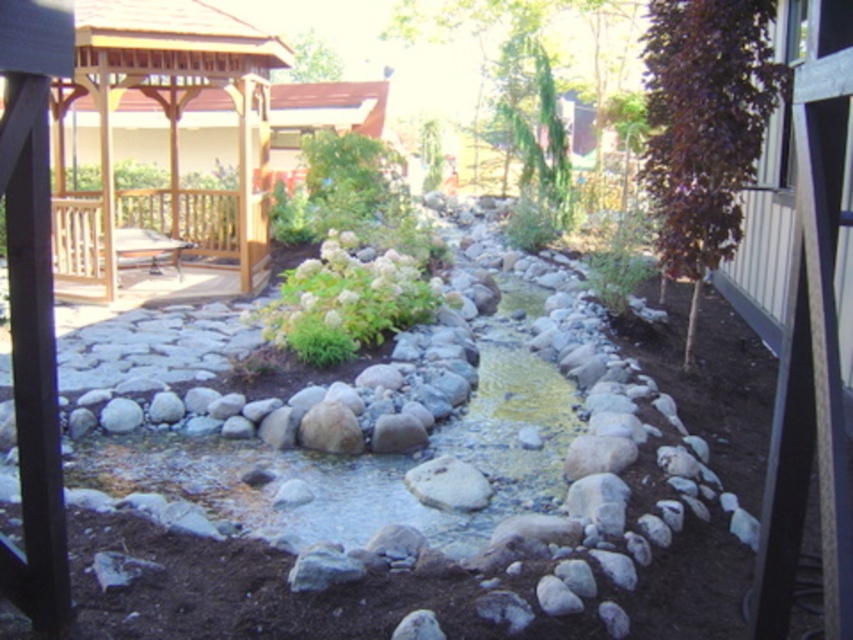
Is wooden gazebo at upper left to the right of wooden bench at left from the viewer's perspective?

Indeed, wooden gazebo at upper left is positioned on the right side of wooden bench at left.

Measure the distance from wooden gazebo at upper left to wooden bench at left.

wooden gazebo at upper left and wooden bench at left are 3.95 feet apart.

Who is more forward, (96, 109) or (102, 220)?

Point (102, 220)

Image resolution: width=853 pixels, height=640 pixels. I want to click on wooden gazebo at upper left, so click(x=167, y=132).

In the scene shown: Is wooden gazebo at upper left closer to camera compared to white fluffy bush at center?

No, wooden gazebo at upper left is further to the viewer.

Does wooden gazebo at upper left have a greater height compared to white fluffy bush at center?

Yes, wooden gazebo at upper left is taller than white fluffy bush at center.

You are a GUI agent. You are given a task and a screenshot of the screen. Output one action in this format:
    pyautogui.click(x=<x>, y=<y>)
    Task: Click on the wooden gazebo at upper left
    The width and height of the screenshot is (853, 640).
    Given the screenshot: What is the action you would take?
    pyautogui.click(x=167, y=132)

Identify the location of wooden gazebo at upper left. (167, 132).

Can you confirm if wooden bench at left is wider than white fluffy bush at center?

Correct, the width of wooden bench at left exceeds that of white fluffy bush at center.

Which is more to the left, wooden bench at left or white fluffy bush at center?

Positioned to the left is wooden bench at left.

Identify the location of wooden bench at left. This screenshot has height=640, width=853. (x=158, y=232).

This screenshot has height=640, width=853. In order to click on wooden bench at left in this screenshot , I will do `click(158, 232)`.